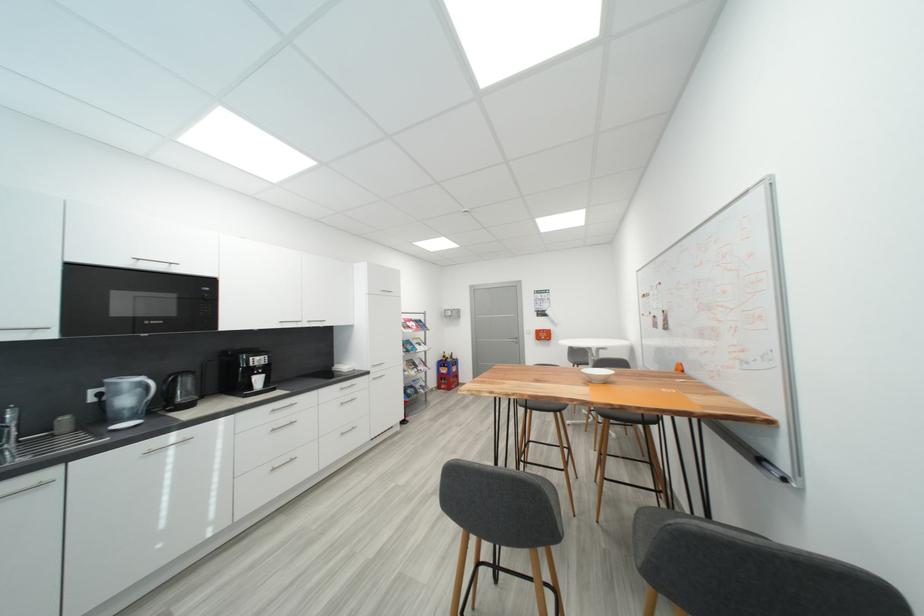
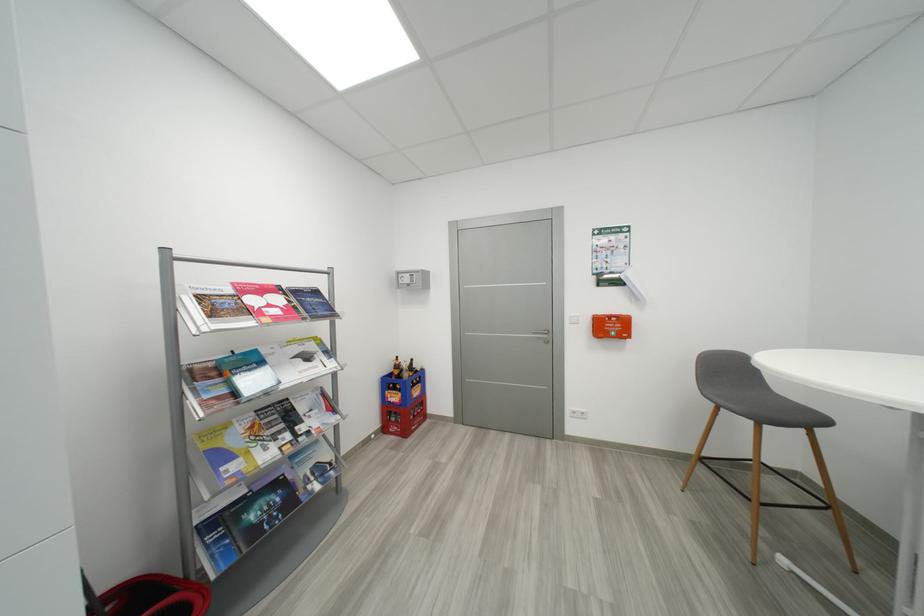
Find the pixel in the second image that matches pixel 427 346 in the first image.

(314, 359)